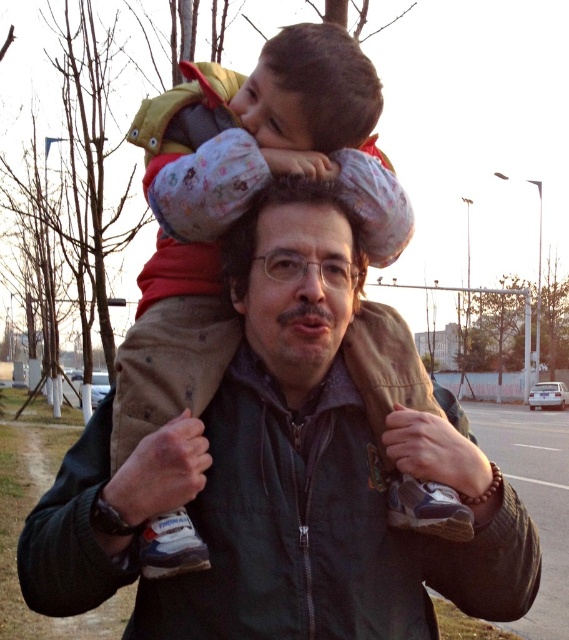
You are standing on the sidewalk and see the dark green jacket at center and the fluffy fleece jacket at upper center. Which jacket is nearer to you?

The dark green jacket at center is closer to the viewer than the fluffy fleece jacket at upper center.

What are the coordinates of the dark green jacket at center?

The dark green jacket at center is located at point (282, 476).